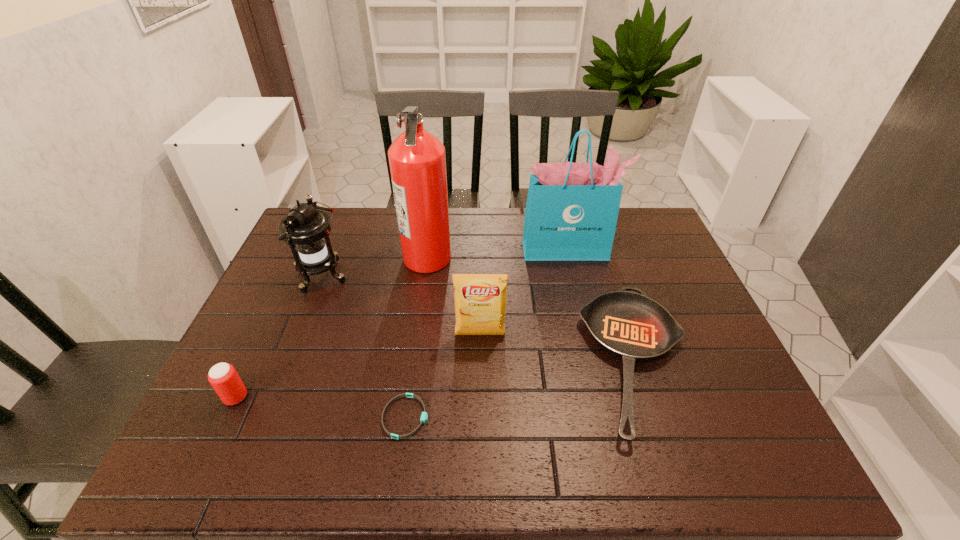
At what (x,y) coordinates should I click in order to perform the action: click on the tallest object. Please return your answer as a coordinate pair (x, y). The height and width of the screenshot is (540, 960). Looking at the image, I should click on (417, 160).

You are a GUI agent. You are given a task and a screenshot of the screen. Output one action in this format:
    pyautogui.click(x=<x>, y=<y>)
    Task: Click on the shopping bag
    This screenshot has height=540, width=960.
    Given the screenshot: What is the action you would take?
    pyautogui.click(x=571, y=214)

Find the location of `lantern`. lantern is located at coordinates (306, 230).

In order to click on the fifth object from left to right in this screenshot , I will do `click(480, 299)`.

Identify the location of crisp (potato chip). The width and height of the screenshot is (960, 540). click(x=480, y=299).

This screenshot has width=960, height=540. In order to click on beer can in this screenshot , I will do `click(223, 377)`.

Locate an element on the screen. frying pan is located at coordinates (632, 326).

Find the location of a particular element. the shortest object is located at coordinates (424, 416).

You are a GUI agent. You are given a task and a screenshot of the screen. Output one action in this format:
    pyautogui.click(x=<x>, y=<y>)
    Task: Click on the free space located at the nozzle of the tallest object
    This screenshot has height=540, width=960.
    Given the screenshot: What is the action you would take?
    pyautogui.click(x=518, y=257)

Where is `vacant space located 0.120m on the front of the second tallest object`? vacant space located 0.120m on the front of the second tallest object is located at coordinates (576, 287).